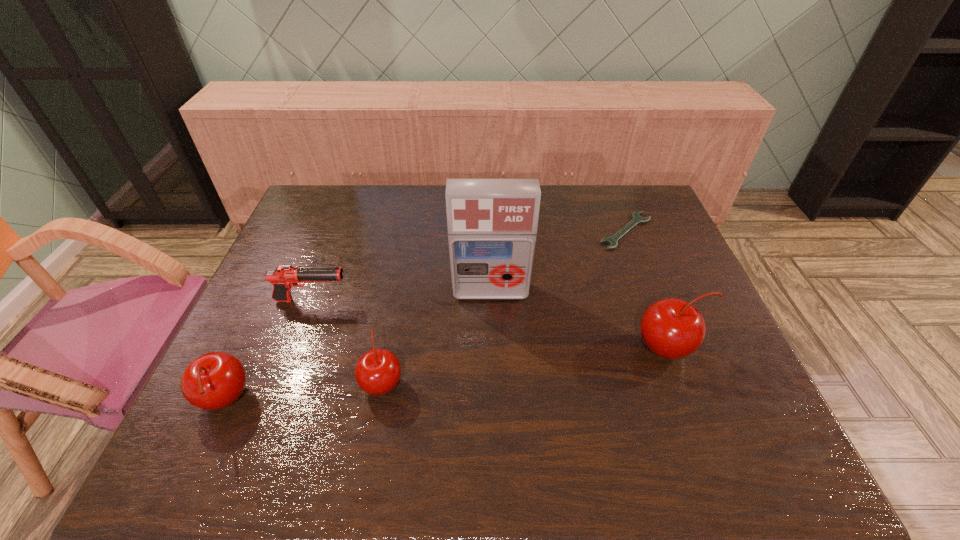
Where is `vacant space located 0.050m on the back of the leftmost cherry`? vacant space located 0.050m on the back of the leftmost cherry is located at coordinates 245,356.

You are a GUI agent. You are given a task and a screenshot of the screen. Output one action in this format:
    pyautogui.click(x=<x>, y=<y>)
    Task: Click on the vacant space located on the right of the shortest cherry
    Image resolution: width=960 pixels, height=540 pixels.
    Given the screenshot: What is the action you would take?
    coord(514,382)

The width and height of the screenshot is (960, 540). What are the coordinates of `vacant space located 0.340m on the back of the rightmost cherry` in the screenshot? It's located at (x=628, y=241).

Locate an element on the screen. free space located 0.380m on the front of the farthest object is located at coordinates click(x=672, y=353).

The image size is (960, 540). Find the location of `free space located at the aiming end of the gun`. free space located at the aiming end of the gun is located at coordinates (397, 300).

The image size is (960, 540). I want to click on vacant space located on the front-facing side of the third object from right to left, so click(x=493, y=414).

You are a GUI agent. You are given a task and a screenshot of the screen. Output one action in this format:
    pyautogui.click(x=<x>, y=<y>)
    Task: Click on the object located in the far edge section of the desktop
    
    Given the screenshot: What is the action you would take?
    pyautogui.click(x=636, y=218)

You are a GUI agent. You are given a task and a screenshot of the screen. Output one action in this format:
    pyautogui.click(x=<x>, y=<y>)
    Task: Click on the cherry positioned at the left edge
    Image resolution: width=960 pixels, height=540 pixels.
    Given the screenshot: What is the action you would take?
    pyautogui.click(x=215, y=380)

Locate an element on the screen. This screenshot has width=960, height=540. gun at the left edge is located at coordinates (284, 277).

I want to click on cherry located in the right edge section of the desktop, so click(x=671, y=328).